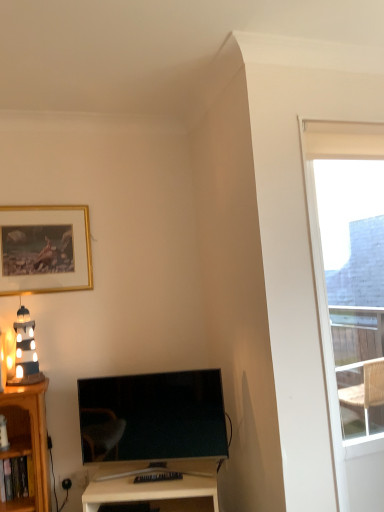
Find the location of a particular element. The image size is (384, 512). free space below matte black tv at lower center (from a real-world perspective) is located at coordinates (130, 473).